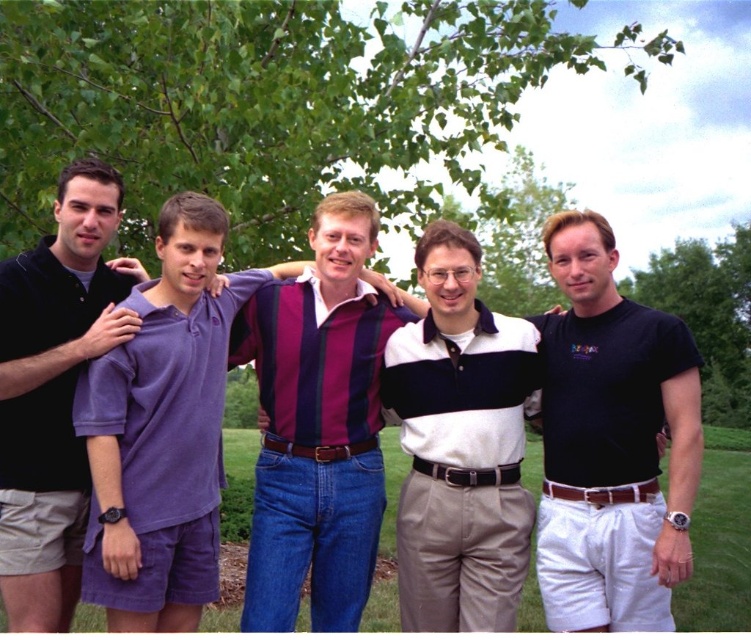
Does purple cotton polo shirt at center have a greater width compared to white striped polo shirt at center?

Yes.

Between purple cotton polo shirt at center and white striped polo shirt at center, which one is positioned lower?

white striped polo shirt at center

Between point (89, 365) and point (511, 540), which one is positioned in front?

Point (89, 365) is in front.

Where is `purple cotton polo shirt at center`? purple cotton polo shirt at center is located at coordinates (163, 429).

What do you see at coordinates (276, 104) in the screenshot? I see `green leafy tree at upper center` at bounding box center [276, 104].

Is point (376, 81) positioned in front of point (550, 232)?

No, (376, 81) is behind (550, 232).

Where is `green leafy tree at upper center`? The height and width of the screenshot is (640, 751). green leafy tree at upper center is located at coordinates (276, 104).

Is green leafy tree at upper center below green leafy tree at right?

No, green leafy tree at upper center is not below green leafy tree at right.

Who is more distant from viewer, (143, 228) or (709, 369)?

The point (709, 369) is behind.

In order to click on green leafy tree at upper center in this screenshot , I will do `click(276, 104)`.